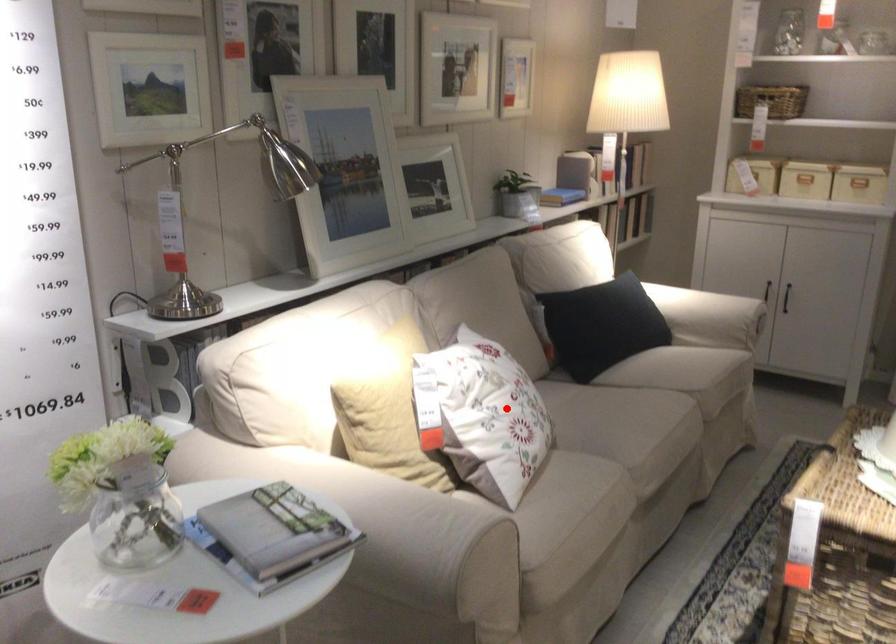
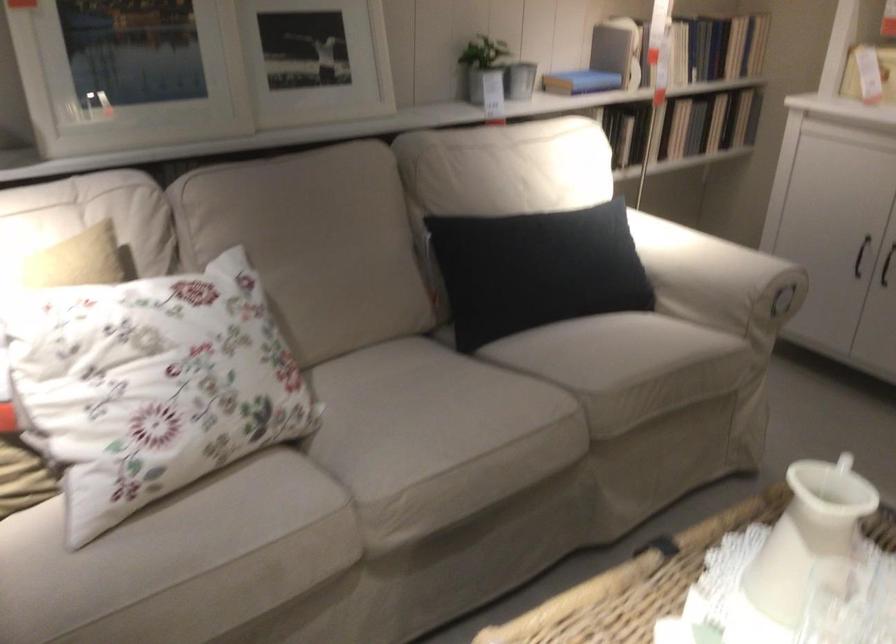
Where in the second image is the point corresponding to the highlighted location from the first image?

(150, 384)